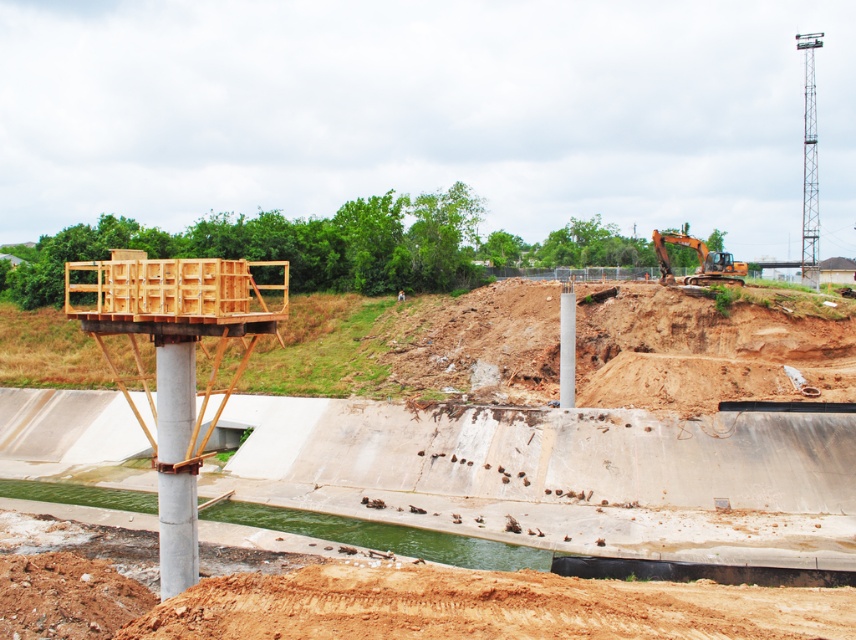
Question: Which object is closer to the camera taking this photo?

Choices:
 (A) orange metallic excavator at upper right
 (B) wooden platform at center-left

Answer: (B)

Question: Which point is closer to the camera?

Choices:
 (A) wooden platform at center-left
 (B) orange metallic excavator at upper right

Answer: (A)

Question: Is wooden platform at center-left closer to camera compared to orange metallic excavator at upper right?

Choices:
 (A) no
 (B) yes

Answer: (B)

Question: Among these objects, which one is farthest from the camera?

Choices:
 (A) wooden platform at center-left
 (B) orange metallic excavator at upper right

Answer: (B)

Question: Can you confirm if wooden platform at center-left is positioned below orange metallic excavator at upper right?

Choices:
 (A) no
 (B) yes

Answer: (B)

Question: Is wooden platform at center-left positioned before orange metallic excavator at upper right?

Choices:
 (A) no
 (B) yes

Answer: (B)